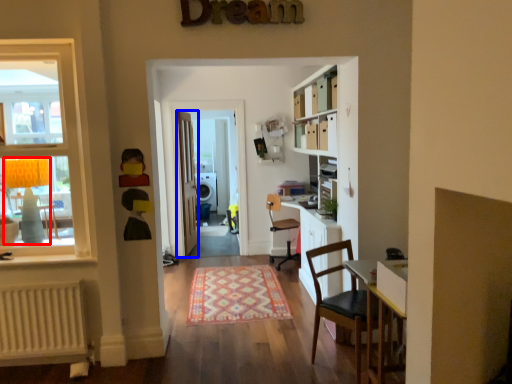
Question: Which point is further to the camera, lamp (highlighted by a red box) or door (highlighted by a blue box)?

Choices:
 (A) lamp
 (B) door

Answer: (B)